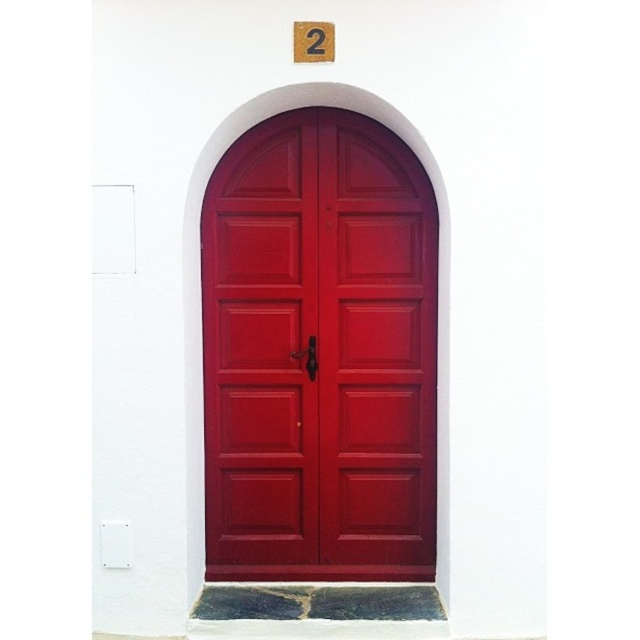
You are a painter hired to paint the doors and the number on them. You have a limited amount of paint. Which object, the matte wood door at center or the wooden number at upper center, will require more paint due to its size?

The matte wood door at center requires more paint than the wooden number at upper center because it has a larger size.

You are a delivery person arriving at a building with a striking red double door. You need to deliver a package to the unit indicated by the wooden number at upper center. The package must be placed directly in front of the matte wood door at center. Can you confirm the correct placement?

The matte wood door at center is located below the wooden number at upper center, so placing the package directly in front of the matte wood door at center will ensure it is correctly positioned under the wooden number at upper center.

You are standing in front of the red double doors. There are two points marked on the wall. The first point is at coordinate point (417,401) and the second point is at coordinate point (332,45). Which point is closer to you?

Point (332,45) is closer to you because point (417,401) is behind it.